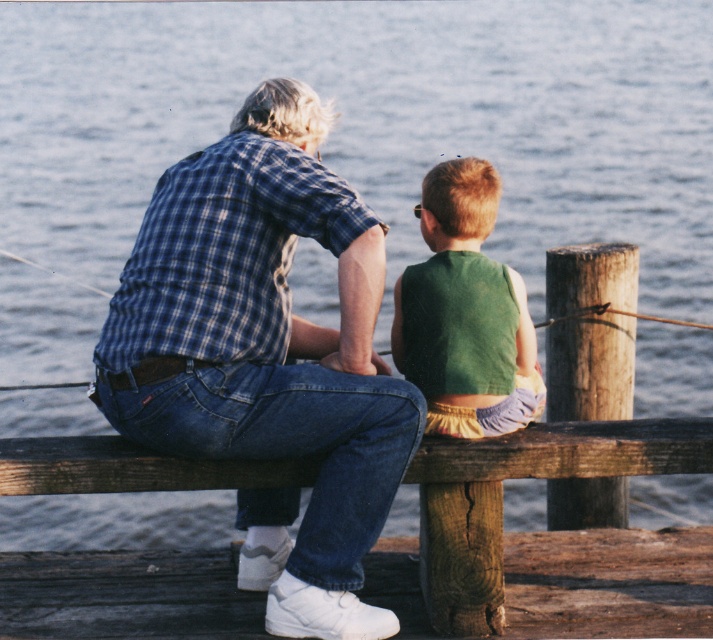
You are a photographer standing on the dock and want to take a photo of the blue plaid shirt at upper left and the wooden bench at center. The camera you are using has a maximum focus range of 1.1 meters. Can you capture both subjects in focus without moving the camera?

The blue plaid shirt at upper left is 1.05 meters from the wooden bench at center. Since the distance between them is within the camera maximum focus range of 1.1 meters, you can capture both subjects in focus without moving the camera.

Consider the image. You are standing on the dock and want to hand a fishing rod to the person wearing the blue plaid shirt at upper left and the green fabric vest at center. Which person is closer to your right side?

The green fabric vest at center is closer to your right side since the blue plaid shirt at upper left is to the left of it.